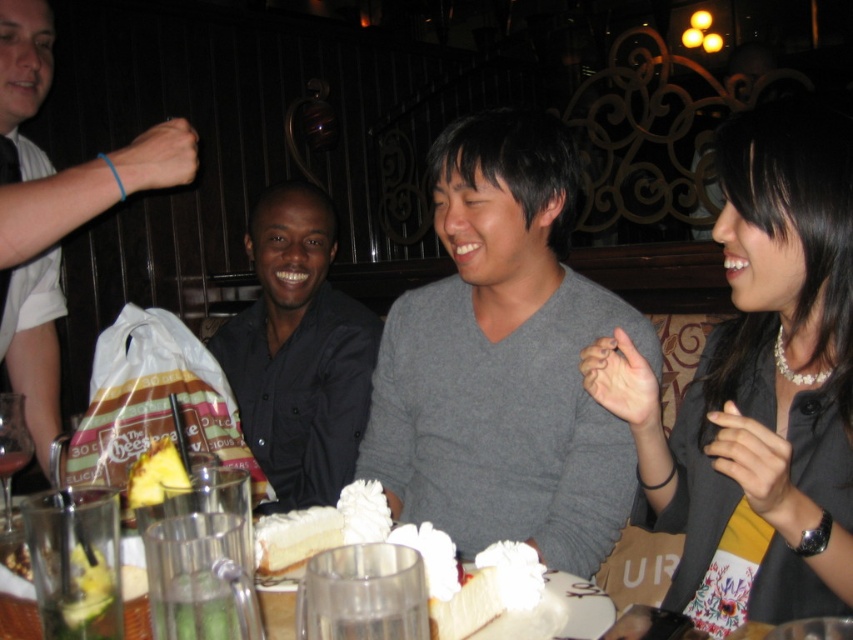
Question: Can you confirm if gray sweater at center is bigger than yellow pineapple at center?

Choices:
 (A) no
 (B) yes

Answer: (B)

Question: Where is white shirt at left located in relation to yellow pineapple at center in the image?

Choices:
 (A) right
 (B) left

Answer: (B)

Question: Which object is closer to the camera taking this photo?

Choices:
 (A) black matte shirt at center
 (B) white shirt at left

Answer: (B)

Question: Is black matte shirt at center further to the viewer compared to white shirt at left?

Choices:
 (A) yes
 (B) no

Answer: (A)

Question: Considering the real-world distances, which object is farthest from the black matte shirt at center?

Choices:
 (A) gray sweater at center
 (B) white shirt at left
 (C) pearl necklace at upper right
 (D) yellow pineapple at center

Answer: (C)

Question: Which point is farther to the camera?

Choices:
 (A) (553, 422)
 (B) (184, 472)

Answer: (A)